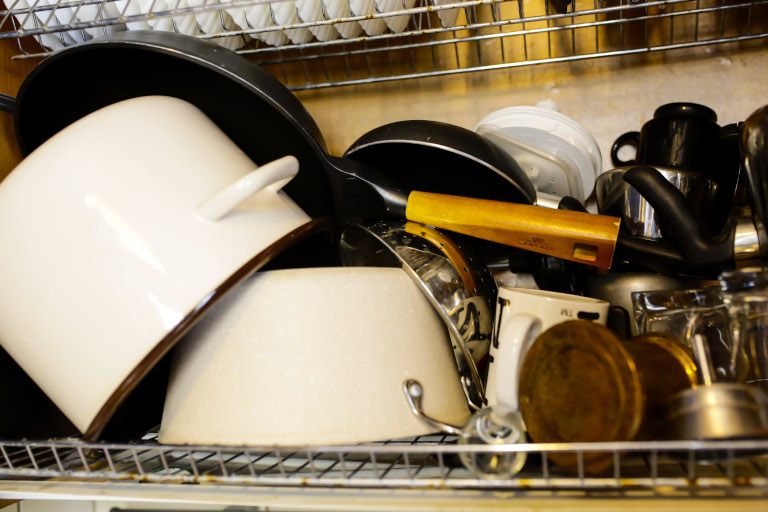
Identify the location of handle. This screenshot has height=512, width=768. (266, 170), (412, 393), (667, 200), (627, 137).